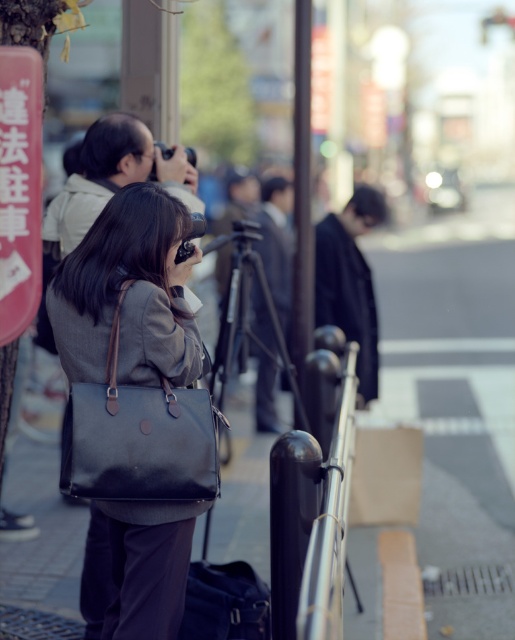
Based on the photo, you are a delivery person who needs to place both the dark brown canvas bag at center and the matte brown bag at center into a storage box that can only hold items up to the size of the larger bag. Which bag should you prioritize placing first?

You should prioritize placing the dark brown canvas bag at center first because it is larger than the matte brown bag at center, ensuring it fits into the storage box before smaller items.

You are a delivery person who needs to place both the dark brown canvas bag at center and the matte brown bag at center into a delivery box that can only hold items up to 12 inches in width. Based on their widths, can both bags fit side by side in the box?

The dark brown canvas bag at center might be wider than matte brown bag at center. However, without exact measurements, it is uncertain if their combined widths exceed 12 inches. Check the actual dimensions before deciding.